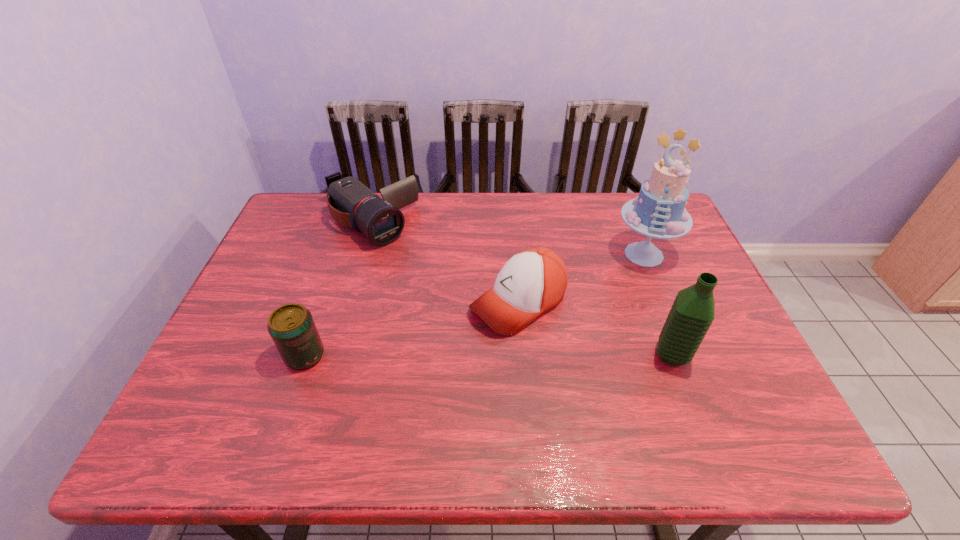
You are a GUI agent. You are given a task and a screenshot of the screen. Output one action in this format:
    pyautogui.click(x=<x>, y=<y>)
    Task: Click on the vacant space that's between the tallest object and the baseball cap
    
    Given the screenshot: What is the action you would take?
    pyautogui.click(x=581, y=279)

The width and height of the screenshot is (960, 540). In order to click on empty space between the beer can and the camcorder in this screenshot , I will do pos(337,289).

Locate an element on the screen. Image resolution: width=960 pixels, height=540 pixels. unoccupied position between the fourth shortest object and the baseball cap is located at coordinates (595, 329).

At what (x,y) coordinates should I click in order to perform the action: click on free space between the beer can and the fourth shortest object. Please return your answer as a coordinate pair (x, y). This screenshot has width=960, height=540. Looking at the image, I should click on (489, 355).

Locate which object ranks third in proximity to the water bottle. Please provide its 2D coordinates. Your answer should be formatted as a tuple, i.e. [(x, y)], where the tuple contains the x and y coordinates of a point satisfying the conditions above.

[(351, 203)]

Identify which object is located as the third nearest to the fourth shortest object. Please provide its 2D coordinates. Your answer should be formatted as a tuple, i.e. [(x, y)], where the tuple contains the x and y coordinates of a point satisfying the conditions above.

[(351, 203)]

Image resolution: width=960 pixels, height=540 pixels. What are the coordinates of `free region that satisfies the following two spatial constraints: 1. on the back side of the tallest object; 2. on the right side of the water bottle` in the screenshot? It's located at (634, 254).